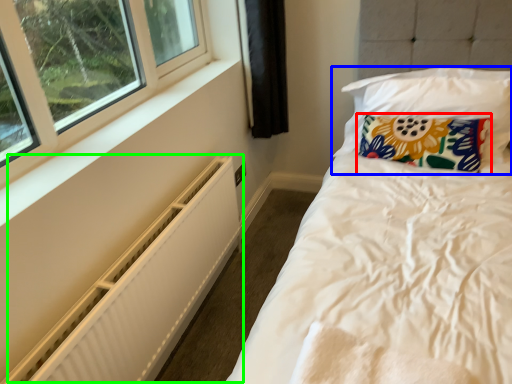
Question: Considering the real-world distances, which object is farthest from pillow (highlighted by a red box)? pillow (highlighted by a blue box) or radiator (highlighted by a green box)?

Choices:
 (A) pillow
 (B) radiator

Answer: (B)